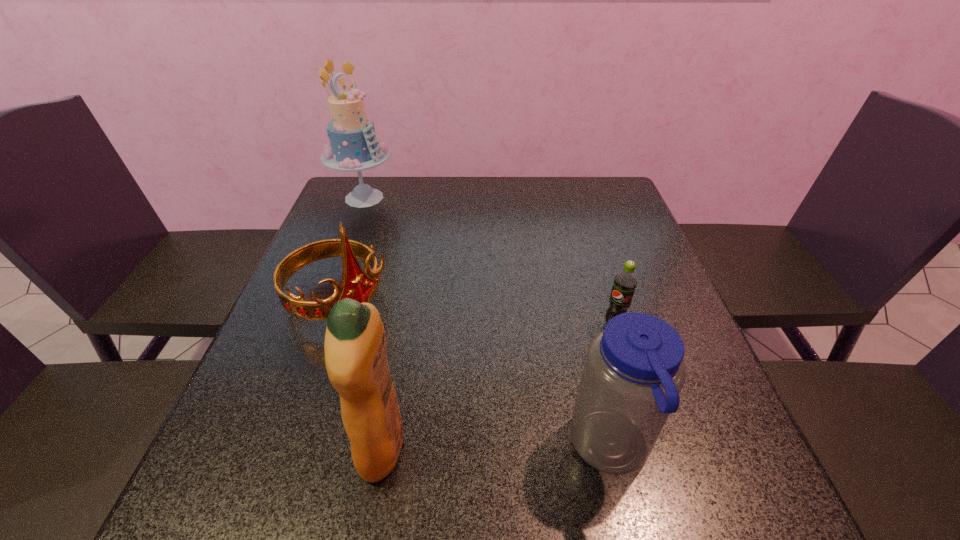
Find the location of a particular element. The height and width of the screenshot is (540, 960). free spot located on the front-facing side of the tiara is located at coordinates (477, 414).

Find the location of a particular element. The width and height of the screenshot is (960, 540). free space located 0.210m on the front-facing side of the tiara is located at coordinates (438, 382).

Locate an element on the screen. Image resolution: width=960 pixels, height=540 pixels. object that is positioned at the far edge is located at coordinates (353, 147).

This screenshot has width=960, height=540. Find the location of `detergent located in the near edge section of the desktop`. detergent located in the near edge section of the desktop is located at coordinates (355, 348).

At what (x,y) coordinates should I click in order to perform the action: click on water bottle positioned at the near edge. Please return your answer as a coordinate pair (x, y). Looking at the image, I should click on tap(634, 370).

Locate an element on the screen. cake at the left edge is located at coordinates (353, 147).

You are a GUI agent. You are given a task and a screenshot of the screen. Output one action in this format:
    pyautogui.click(x=<x>, y=<y>)
    Task: Click on the tiara located in the left edge section of the desktop
    Image resolution: width=960 pixels, height=540 pixels.
    Given the screenshot: What is the action you would take?
    pyautogui.click(x=356, y=284)

Where is `water bottle at the right edge`? The width and height of the screenshot is (960, 540). water bottle at the right edge is located at coordinates (634, 370).

The height and width of the screenshot is (540, 960). In order to click on soda positioned at the right edge in this screenshot , I will do `click(625, 282)`.

Identify the location of object that is at the far left corner. (353, 147).